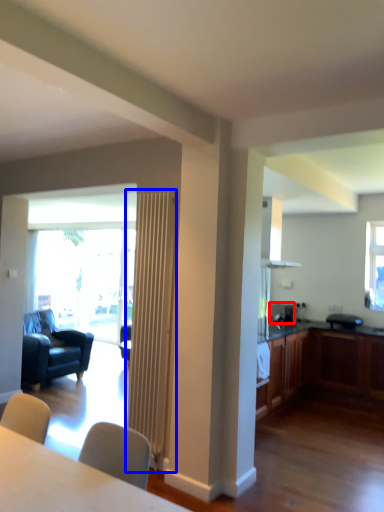
Question: Which of the following is the closest to the observer, appliance (highlighted by a red box) or radiator (highlighted by a blue box)?

Choices:
 (A) appliance
 (B) radiator

Answer: (B)